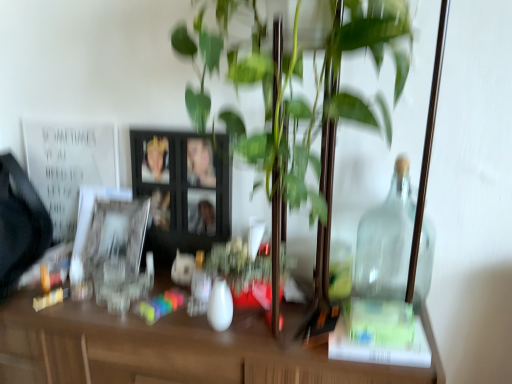
Question: Based on their positions, is green glossy plant at center located to the left or right of white paper at upper left?

Choices:
 (A) right
 (B) left

Answer: (A)

Question: Considering the positions of green glossy plant at center and white paper at upper left in the image, is green glossy plant at center bigger or smaller than white paper at upper left?

Choices:
 (A) big
 (B) small

Answer: (A)

Question: Which object is the closest to the black wooden picture frame at center, the 1th picture frame in the right-to-left sequence?

Choices:
 (A) transparent glass jar at right
 (B) white glossy vase at center
 (C) white glossy picture frame at left, acting as the first picture frame starting from the left
 (D) white paper at upper left
 (E) green glossy plant at center

Answer: (C)

Question: Which object is positioned farthest from the white paper at upper left?

Choices:
 (A) transparent glass jar at right
 (B) black wooden picture frame at center, the 1th picture frame in the right-to-left sequence
 (C) white glossy vase at center
 (D) white glossy picture frame at left, acting as the first picture frame starting from the left
 (E) green glossy plant at center

Answer: (A)